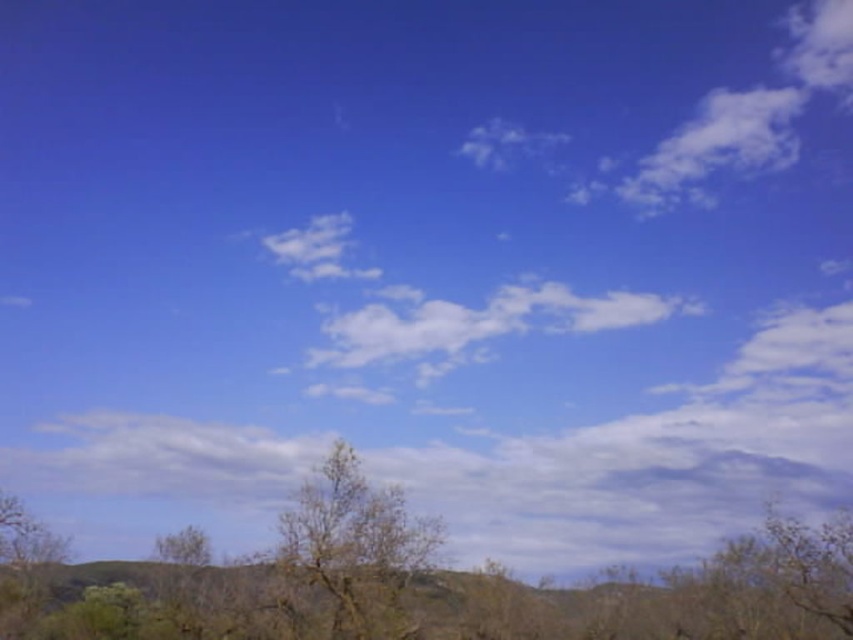
Question: Where is brown textured tree at center located in relation to bare wood tree at lower left in the image?

Choices:
 (A) above
 (B) below

Answer: (A)

Question: Does brown textured tree at center have a lesser width compared to bare wood tree at lower left?

Choices:
 (A) no
 (B) yes

Answer: (A)

Question: Does brown textured tree at center appear over bare wood tree at lower left?

Choices:
 (A) yes
 (B) no

Answer: (A)

Question: Which of the following is the farthest from the observer?

Choices:
 (A) bare wood tree at lower left
 (B) brown textured tree at center

Answer: (A)